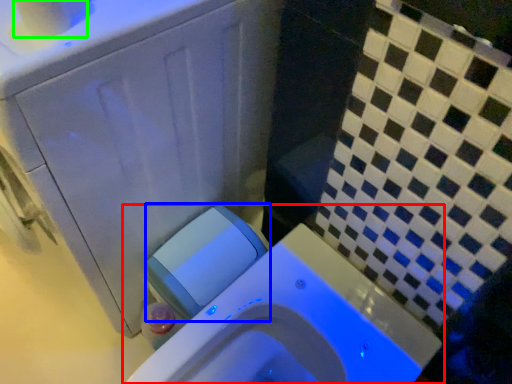
Question: Estimate the real-world distances between objects in this image. Which object is closer to toilet (highlighted by a red box), water tank (highlighted by a blue box) or toilet paper (highlighted by a green box)?

Choices:
 (A) water tank
 (B) toilet paper

Answer: (A)